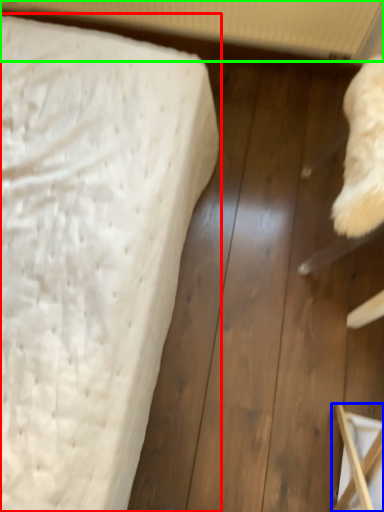
Question: Which is farther away from bed (highlighted by a red box)? furniture (highlighted by a blue box) or radiator (highlighted by a green box)?

Choices:
 (A) furniture
 (B) radiator

Answer: (B)